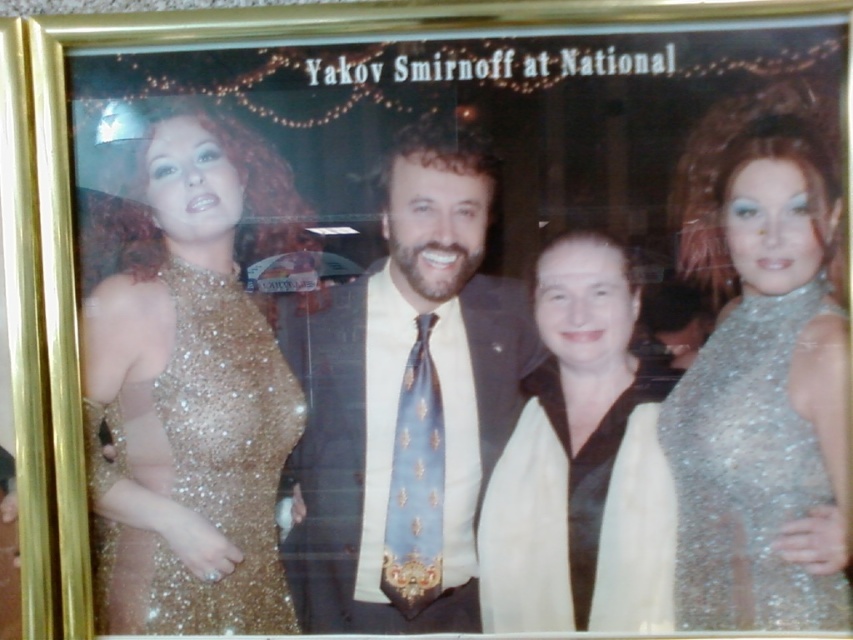
Which is in front, point (625, 552) or point (229, 323)?

Point (625, 552) is more forward.

Does satin white scarf at center appear over sparkly gold dress at left?

Correct, satin white scarf at center is located above sparkly gold dress at left.

Is point (589, 593) farther from viewer compared to point (105, 618)?

No, it is not.

Find the location of a particular element. The height and width of the screenshot is (640, 853). satin white scarf at center is located at coordinates (579, 467).

Who is higher up, shiny blue tie at center or sparkly gold dress at left?

shiny blue tie at center is above.

Can you confirm if shiny blue tie at center is positioned below sparkly gold dress at left?

No.

Between point (293, 308) and point (224, 442), which one is positioned in front?

Point (224, 442) is more forward.

You are a GUI agent. You are given a task and a screenshot of the screen. Output one action in this format:
    pyautogui.click(x=<x>, y=<y>)
    Task: Click on the shiny blue tie at center
    Image resolution: width=853 pixels, height=640 pixels.
    Given the screenshot: What is the action you would take?
    pyautogui.click(x=405, y=401)

Which is below, satin white scarf at center or sparkly silver dress at right?

sparkly silver dress at right is lower down.

Who is taller, satin white scarf at center or sparkly silver dress at right?

With more height is satin white scarf at center.

Find the location of `satin white scarf at center`. satin white scarf at center is located at coordinates (579, 467).